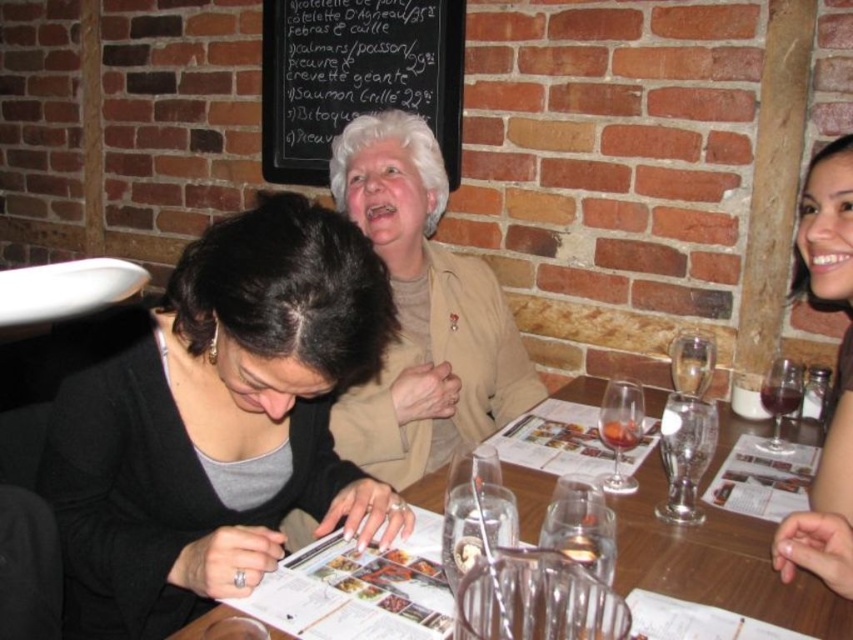
You are a server at the restaurant. You need to place a tall drink on the table. Which object, the clear glass table at center or the translucent glass at table center, should you choose to ensure the drink doesn

The clear glass table at center has a greater height compared to the translucent glass at table center, so you should place the tall drink on the clear glass table at center to ensure it stands securely.

You are a server at this restaurant and need to choose a wine glass for a guest who prefers a wider glass. Which one should you select between the translucent glass wine glass at center and the translucent glass wine glass at right?

The translucent glass wine glass at right has a greater width compared to the translucent glass wine glass at center, so you should choose the translucent glass wine glass at right.

You are a server at the restaurant and need to pour wine for the guests. The guest at the center prefers a full glass, while the guest at the right prefers a half glass. Given the sizes of the translucent glass wine glass at center and the translucent glass wine glass at right, which glass should you fill to the brim and which should you fill halfway?

The translucent glass wine glass at center is much taller than the translucent glass wine glass at right. Therefore, to accommodate the guest at the center who prefers a full glass, you should fill the taller glass to the brim. For the guest at the right with the shorter glass, filling it halfway would be appropriate to meet their preference.